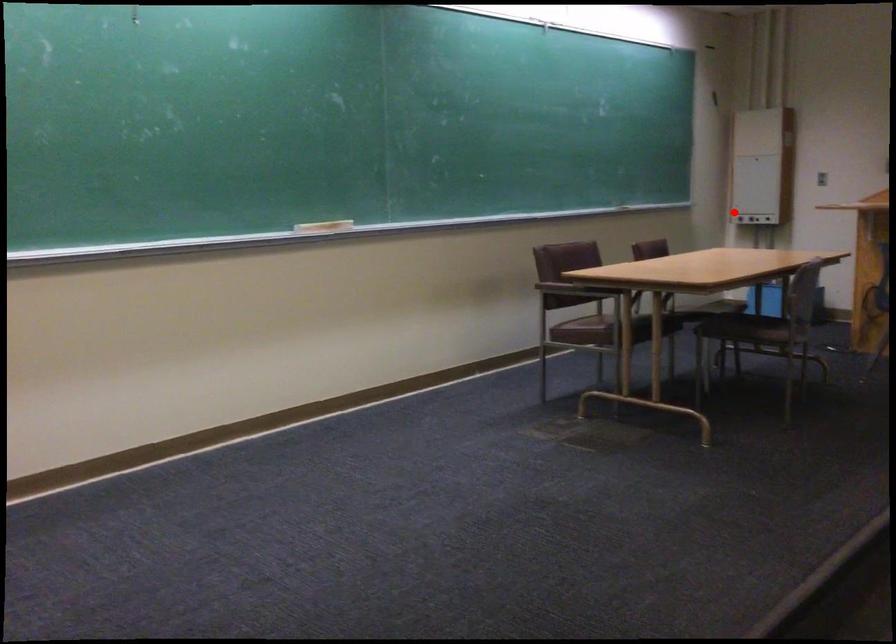
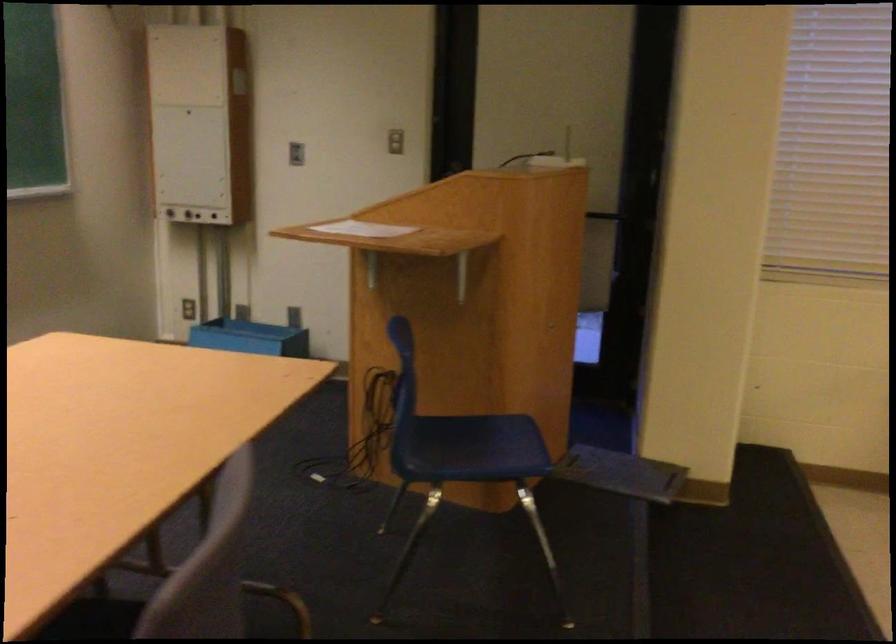
Question: I am providing you with two images of the same scene from different viewpoints. In image1, a red point is highlighted. Considering the same 3D point in image2, which of the following is correct?

Choices:
 (A) It is closer
 (B) It is farther

Answer: (A)